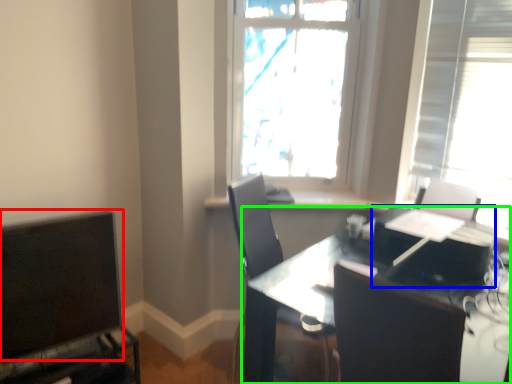
Question: Which is farther away from computer monitor (highlighted by a red box)? computer (highlighted by a blue box) or table (highlighted by a green box)?

Choices:
 (A) computer
 (B) table

Answer: (A)